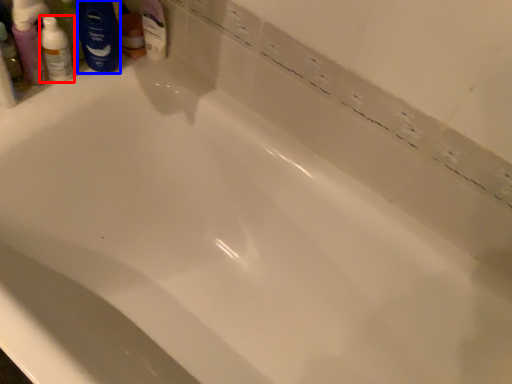
Question: Which object appears farthest to the camera in this image, toiletry (highlighted by a red box) or shaving cream (highlighted by a blue box)?

Choices:
 (A) toiletry
 (B) shaving cream

Answer: (B)